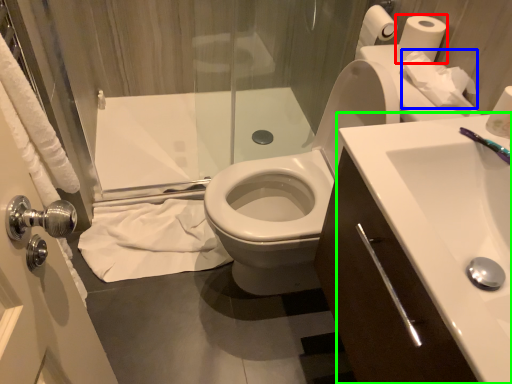
Question: Estimate the real-world distances between objects in this image. Which object is closer to toilet paper (highlighted by a red box), toilet paper (highlighted by a blue box) or sink (highlighted by a green box)?

Choices:
 (A) toilet paper
 (B) sink

Answer: (A)